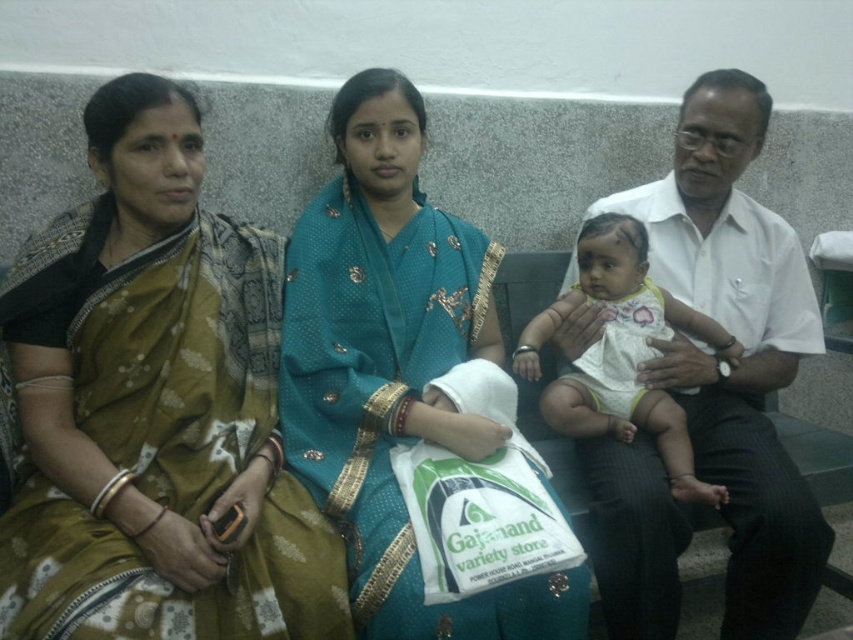
Which is more to the left, brown silk saree at left or white cotton baby at center?

From the viewer's perspective, brown silk saree at left appears more on the left side.

Does brown silk saree at left appear over white cotton baby at center?

Yes, brown silk saree at left is above white cotton baby at center.

The height and width of the screenshot is (640, 853). In order to click on brown silk saree at left in this screenshot , I will do `click(154, 408)`.

Between white smooth shirt at right and white cotton baby at center, which one appears on the left side from the viewer's perspective?

white cotton baby at center is more to the left.

Which of these two, white smooth shirt at right or white cotton baby at center, stands shorter?

With less height is white cotton baby at center.

Find the location of a particular element. The image size is (853, 640). white smooth shirt at right is located at coordinates (741, 342).

Identify the location of white smooth shirt at right. This screenshot has height=640, width=853. (741, 342).

Does point (335, 129) come in front of point (720, 129)?

No, it is not.

What do you see at coordinates (393, 369) in the screenshot? I see `teal silk saree at center` at bounding box center [393, 369].

This screenshot has width=853, height=640. What are the coordinates of `teal silk saree at center` in the screenshot? It's located at (393, 369).